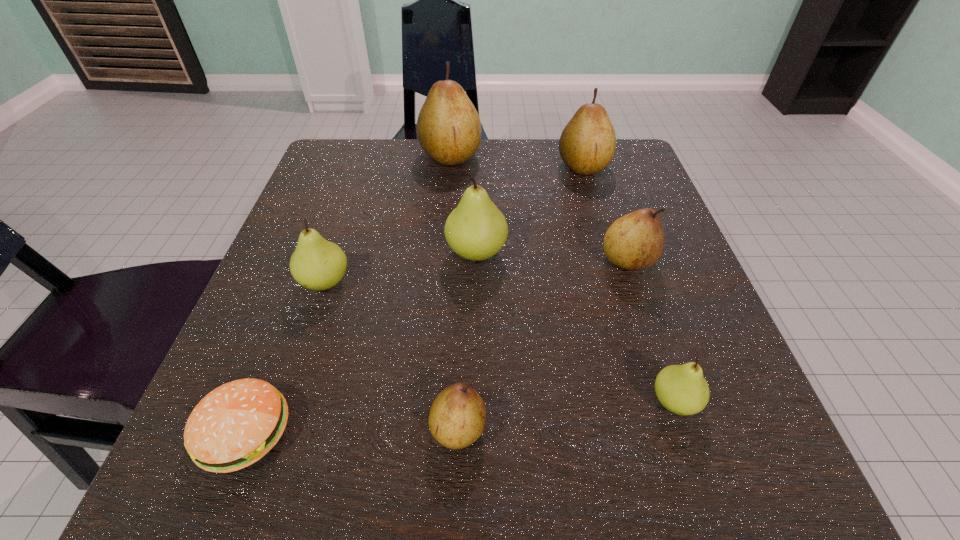
Locate an element on the screen. This screenshot has width=960, height=540. patty is located at coordinates 235,425.

Find the location of a particular element. This screenshot has width=960, height=540. brown patty is located at coordinates (235, 425).

Locate an element on the screen. The width and height of the screenshot is (960, 540). free point located on the right of the tallest pear is located at coordinates (601, 156).

Find the location of a particular element. free spot located on the left of the second biggest brown pear is located at coordinates (473, 166).

Locate an element on the screen. The width and height of the screenshot is (960, 540). vacant space located on the right of the biggest green pear is located at coordinates (649, 253).

The height and width of the screenshot is (540, 960). I want to click on vacant space located 0.180m on the back of the leftmost pear, so click(351, 203).

Identify the location of free spot located on the left of the third biggest brown pear. (460, 261).

Identify the location of blank space located on the back of the smallest green pear. Image resolution: width=960 pixels, height=540 pixels. pyautogui.click(x=628, y=262).

Find the location of `blank space located 0.230m on the back of the nearest brown pear`. blank space located 0.230m on the back of the nearest brown pear is located at coordinates (464, 279).

You are a GUI agent. You are given a task and a screenshot of the screen. Output one action in this format:
    pyautogui.click(x=<x>, y=<y>)
    Task: Click on the vacant space located on the right of the patty
    
    Given the screenshot: What is the action you would take?
    pyautogui.click(x=593, y=431)